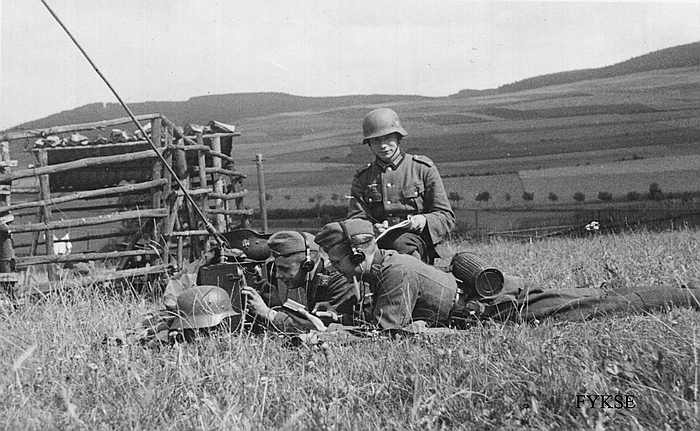
You are a GUI agent. You are given a task and a screenshot of the screen. Output one action in this format:
    pyautogui.click(x=<x>, y=<y>)
    Task: Click on the left cup of headset
    The width and height of the screenshot is (700, 431).
    Given the screenshot: What is the action you would take?
    pyautogui.click(x=306, y=262)